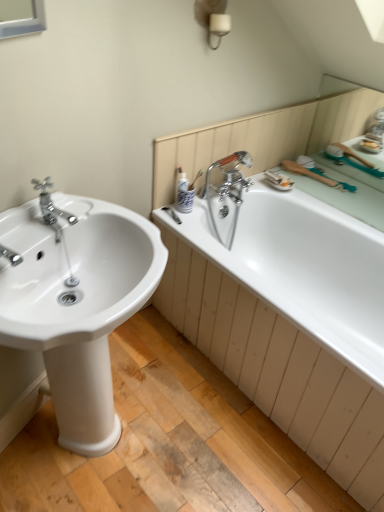
Question: From the image's perspective, is white glossy bathtub at right positioned above or below white glossy sink at left?

Choices:
 (A) above
 (B) below

Answer: (A)

Question: Based on their sizes in the image, would you say white glossy bathtub at right is bigger or smaller than white glossy sink at left?

Choices:
 (A) small
 (B) big

Answer: (B)

Question: Considering the real-world distances, which object is farthest from the polished chrome faucet at left?

Choices:
 (A) white glossy sink at left
 (B) white glossy bathtub at right

Answer: (B)

Question: Which of these objects is positioned closest to the white glossy sink at left?

Choices:
 (A) polished chrome faucet at left
 (B) white glossy bathtub at right

Answer: (A)